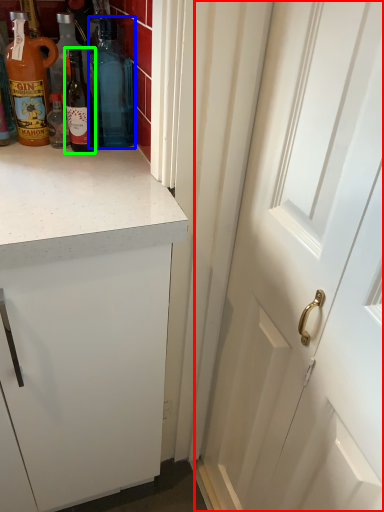
Question: Which object is the closest to the door (highlighted by a red box)? Choose among these: bottle (highlighted by a blue box) or bottle (highlighted by a green box).

Choices:
 (A) bottle
 (B) bottle

Answer: (A)